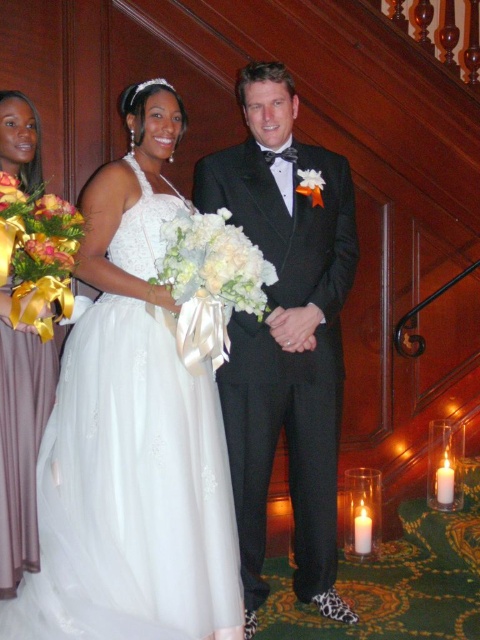
You are a photographer at a wedding venue. You need to arrange two brides in a photo shoot. The white tulle dress at center and the mauve satin dress at left are available. Which dress requires more space to accommodate its width?

The white tulle dress at center might be wider than the mauve satin dress at left, so it requires more space to accommodate its width.

You are a photographer at the wedding venue and need to capture a shot that includes both the mauve satin dress at left and the yellow satin ribbon at left. Based on their positions, which one should you focus on first to ensure both are in frame?

The mauve satin dress at left is below the yellow satin ribbon at left, so you should focus on the yellow satin ribbon at left first to ensure both are in frame.